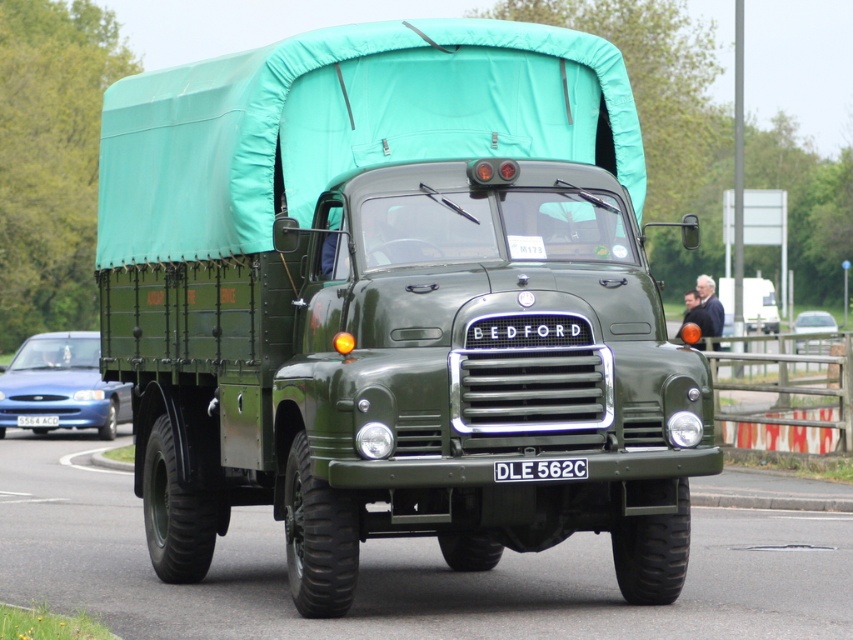
You are a photographer planning to capture a shot of the green matte truck at center and the metallic silver car at center. Since you want both vehicles to appear equally sized in your photo, which vehicle should you move closer to, and which one should you move farther away from the camera?

The green matte truck at center has a lesser width compared to the metallic silver car at center. To make them appear the same size in the photo, you should move the green matte truck at center closer to the camera and move the metallic silver car at center farther away. This adjustment compensates for their actual size difference, ensuring both vehicles are depicted at equal scale in the final image.

You are a traffic officer observing a road where a green matte truck at center and a metallic silver car at center are approaching each other. The minimum safe distance required for both vehicles to pass each other without collision is 70 feet. Based on the scene, can they safely pass each other?

The green matte truck at center is 67.43 feet from the metallic silver car at center. Since the required safe distance is 70 feet, they cannot safely pass each other as the current distance is shorter than the required minimum.

You are a mechanic inspecting the vintage Bedford truck. You notice the green rubber tire at lower center and the matte green coach at center. Which object is positioned to the left of the other?

The green rubber tire at lower center is positioned to the left of the matte green coach at center.